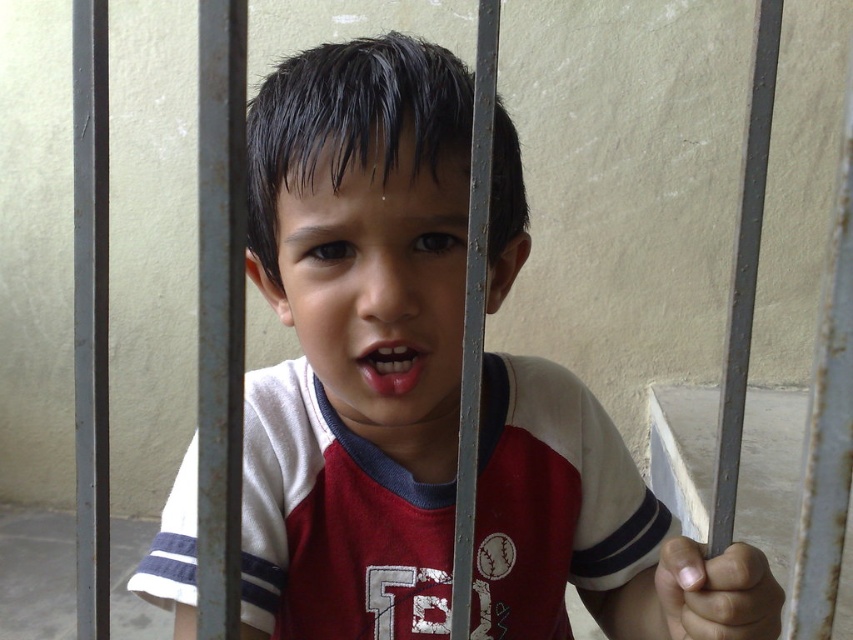
Does smooth skin face at center have a lesser height compared to pink glossy lips at center?

No.

This screenshot has width=853, height=640. What do you see at coordinates (376, 282) in the screenshot?
I see `smooth skin face at center` at bounding box center [376, 282].

Which is behind, point (403, 150) or point (363, 362)?

Positioned behind is point (363, 362).

Find the location of a particular element. This screenshot has height=640, width=853. smooth skin face at center is located at coordinates (376, 282).

Based on the photo, who is shorter, white cotton shirt at center or pink glossy lips at center?

With less height is pink glossy lips at center.

Is point (634, 520) positioned after point (358, 356)?

Yes, point (634, 520) is behind point (358, 356).

Identify the location of white cotton shirt at center. This screenshot has height=640, width=853. (354, 340).

Can you confirm if white cotton shirt at center is bigger than smooth skin face at center?

Yes, white cotton shirt at center is bigger than smooth skin face at center.

Measure the distance between white cotton shirt at center and camera.

A distance of 16.23 inches exists between white cotton shirt at center and camera.

The height and width of the screenshot is (640, 853). In order to click on white cotton shirt at center in this screenshot , I will do `click(354, 340)`.